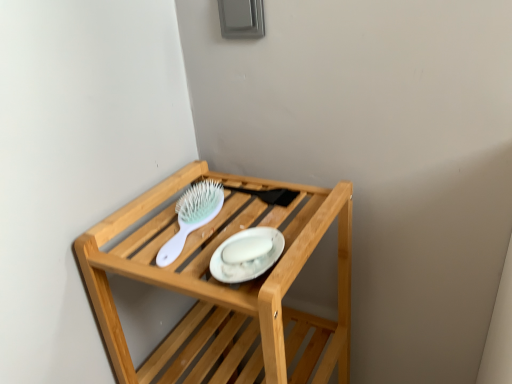
Where is `free space in front of white plastic brush at upper center`? The image size is (512, 384). free space in front of white plastic brush at upper center is located at coordinates (206, 269).